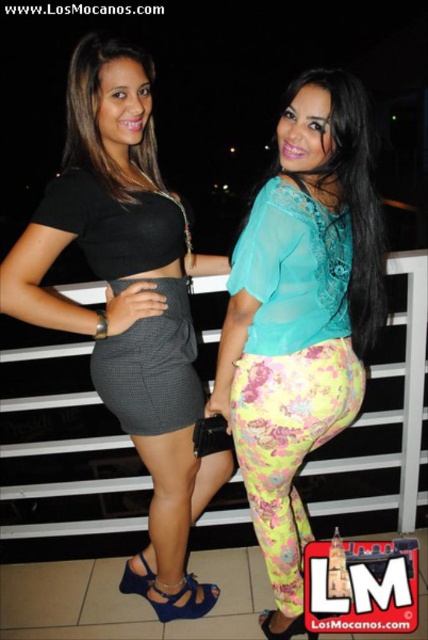
Question: Is matte black top at center to the right of matte black top at upper left from the viewer's perspective?

Choices:
 (A) no
 (B) yes

Answer: (A)

Question: Which object is the farthest from the matte black top at center?

Choices:
 (A) matte black top at upper left
 (B) floral chiffon pants at center
 (C) translucent teal blouse at upper center

Answer: (C)

Question: Is translucent teal blouse at upper center positioned behind matte black top at upper left?

Choices:
 (A) no
 (B) yes

Answer: (A)

Question: Estimate the real-world distances between objects in this image. Which object is farther from the floral chiffon pants at center?

Choices:
 (A) translucent teal blouse at upper center
 (B) gray checkered skirt at center
 (C) matte black top at upper left

Answer: (C)

Question: Which point is farther from the camera taking this photo?

Choices:
 (A) [225, 349]
 (B) [183, 406]
 (C) [152, 65]

Answer: (C)

Question: Can you confirm if matte black top at center is positioned to the left of floral chiffon pants at center?

Choices:
 (A) yes
 (B) no

Answer: (A)